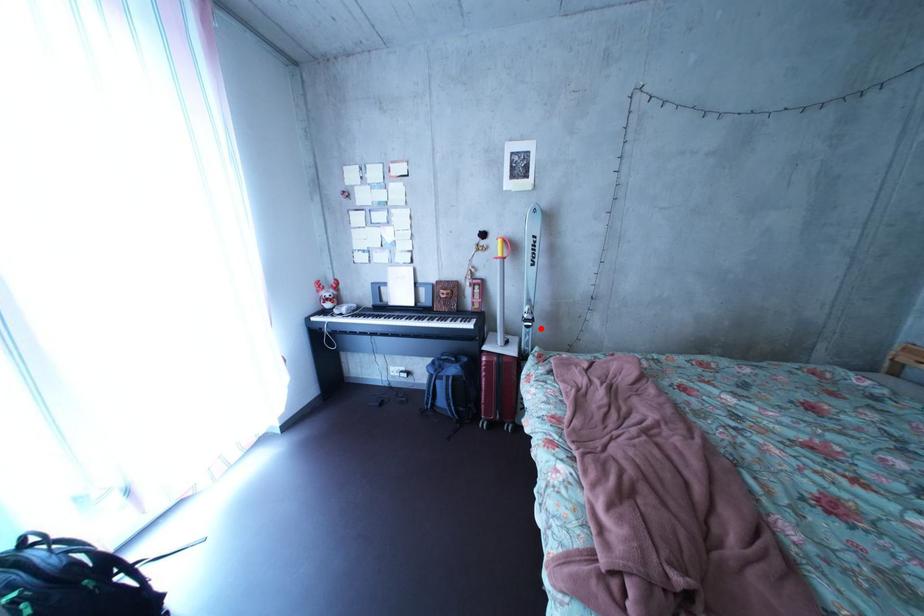
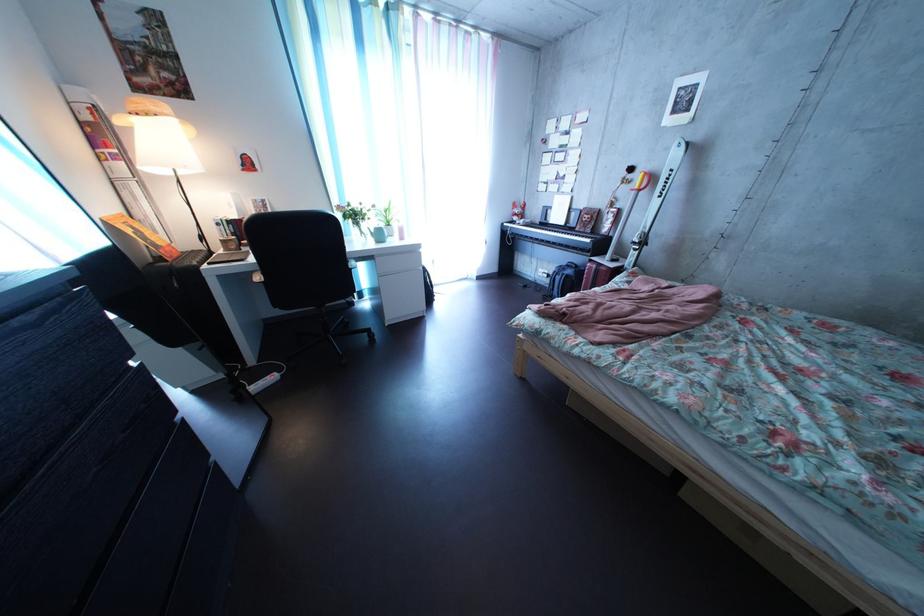
Question: I am providing you with two images of the same scene from different viewpoints. In image1, a red point is highlighted. Considering the same 3D point in image2, which of the following is correct?

Choices:
 (A) It is closer
 (B) It is farther

Answer: (A)